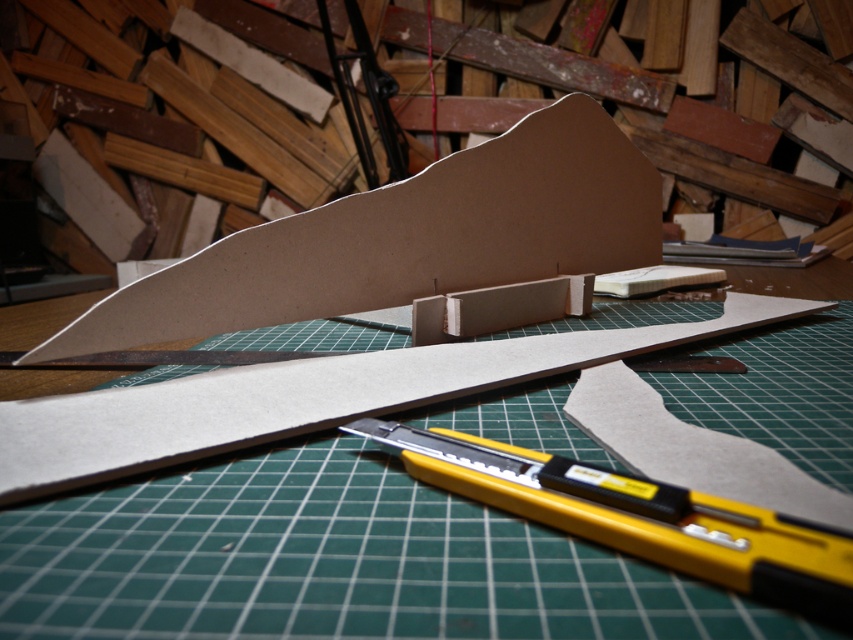
Is green cutting mat at center to the right of brown cardboard at center from the viewer's perspective?

Indeed, green cutting mat at center is positioned on the right side of brown cardboard at center.

The image size is (853, 640). I want to click on green cutting mat at center, so click(331, 561).

Does green cutting mat at center come in front of yellow plastic utility knife at center?

No, it is not.

The image size is (853, 640). Describe the element at coordinates (331, 561) in the screenshot. I see `green cutting mat at center` at that location.

At what (x,y) coordinates should I click in order to perform the action: click on green cutting mat at center. Please return your answer as a coordinate pair (x, y). This screenshot has height=640, width=853. Looking at the image, I should click on point(331,561).

At what (x,y) coordinates should I click in order to perform the action: click on green cutting mat at center. Please return your answer as a coordinate pair (x, y). This screenshot has width=853, height=640. Looking at the image, I should click on (331, 561).

Between brown cardboard at center and yellow plastic utility knife at center, which one has more height?

brown cardboard at center

Can you confirm if brown cardboard at center is positioned to the left of yellow plastic utility knife at center?

Indeed, brown cardboard at center is positioned on the left side of yellow plastic utility knife at center.

Locate an element on the screen. The image size is (853, 640). brown cardboard at center is located at coordinates (407, 237).

Find the location of a particular element. brown cardboard at center is located at coordinates (407, 237).